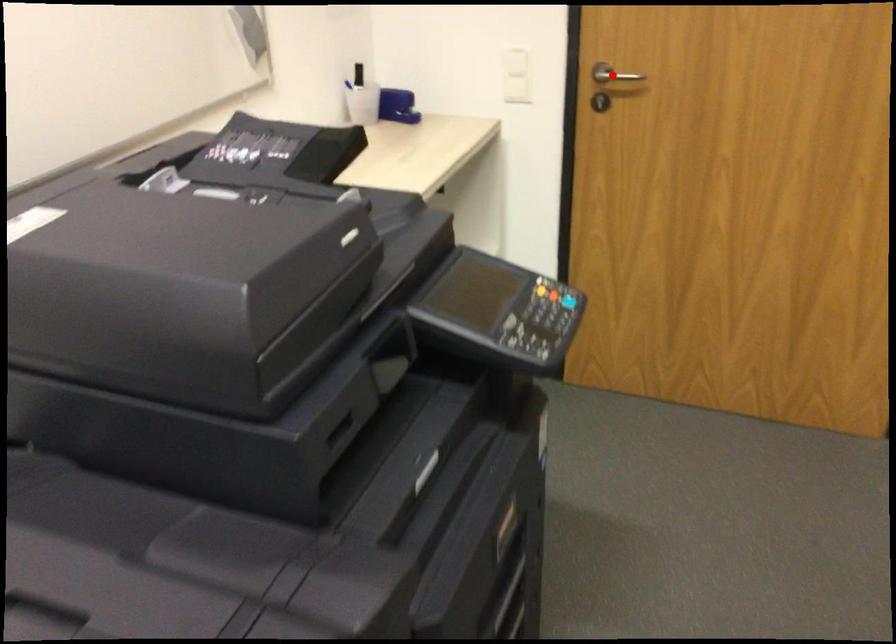
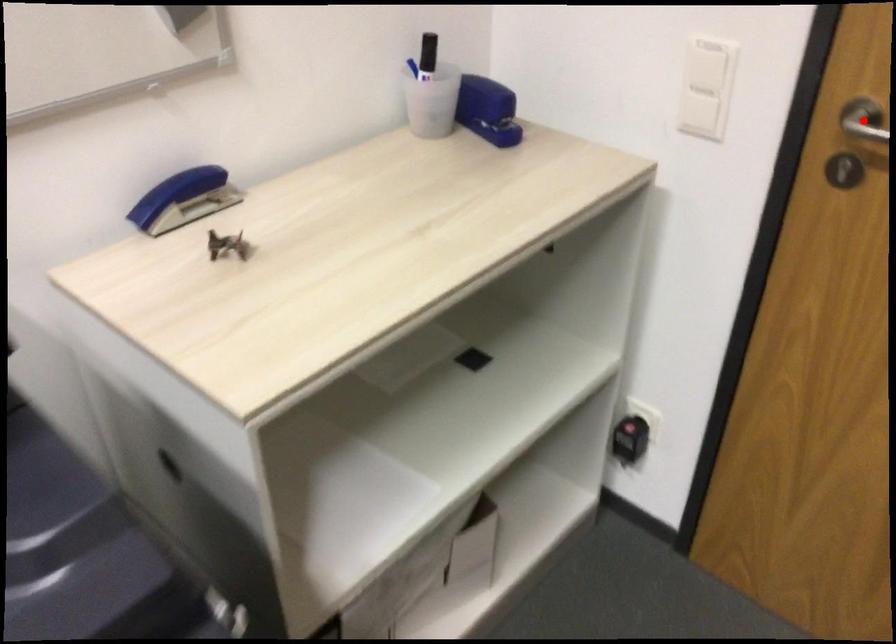
I am providing you with two images of the same scene from different viewpoints. A red point is marked on the first image and another point is marked on the second image. Is the marked point in image1 the same physical position as the marked point in image2?

Yes